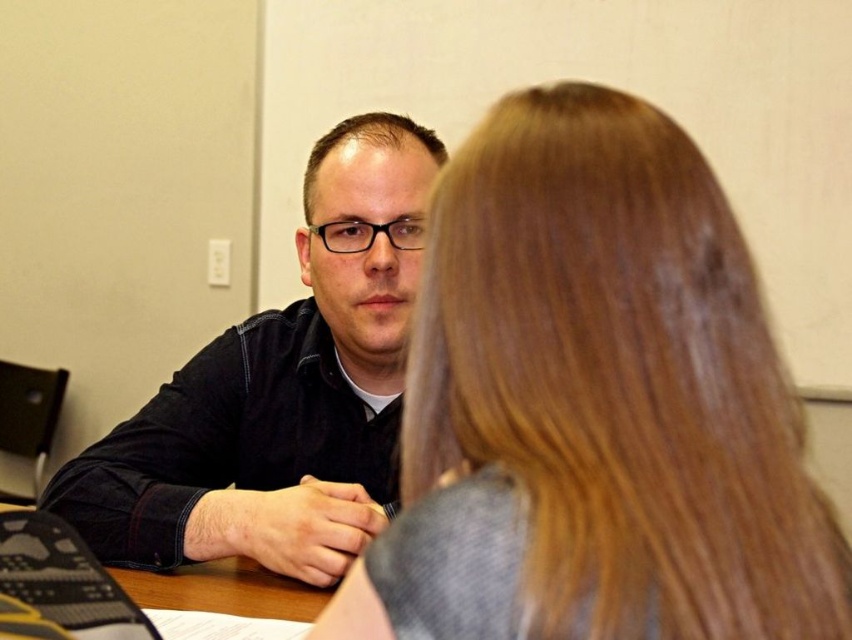
You are a photographer trying to capture a group photo of the people at the dark blue shirt at center and the brown wood table at center. Which object is wider so that you can position your camera accordingly?

The dark blue shirt at center is wider than the brown wood table at center, so you should position your camera to accommodate its width.

You are a photographer trying to capture a candid shot of the two people at the table. The camera you are using has a maximum width of 1 meter for framing objects. Given the smooth brown hair at center and the brown wood table at center, will the camera be able to fit both subjects within the frame without cropping?

The smooth brown hair at center might be wider than brown wood table at center, so there is a possibility that the combined width of both objects exceeds the camera frame limit. However, without exact measurements, it is uncertain. It is recommended to check the total width before capturing the shot.

You are standing in front of the scene described. A drone is about to fly to the dark blue shirt at center. What coordinates should the drone target?

The drone should target the coordinates point at (280, 392) as that is where the dark blue shirt at center is located.